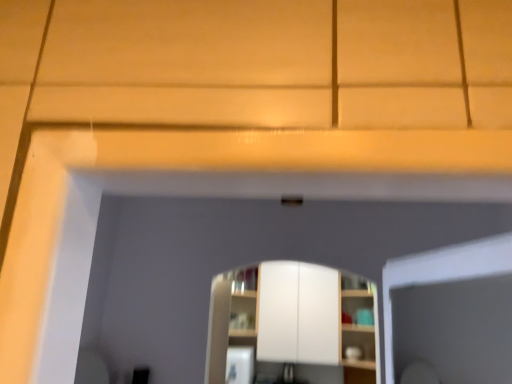
Find the location of `white matte cabinet at center`. white matte cabinet at center is located at coordinates (284, 318).

What do you see at coordinates (284, 318) in the screenshot? I see `white matte cabinet at center` at bounding box center [284, 318].

Identify the location of white matte cabinet at center. Image resolution: width=512 pixels, height=384 pixels. tap(284, 318).